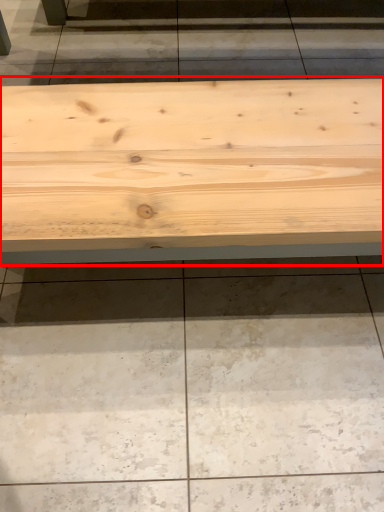
Question: In this image, where is table (annotated by the red box) located relative to concrete?

Choices:
 (A) right
 (B) left

Answer: (B)